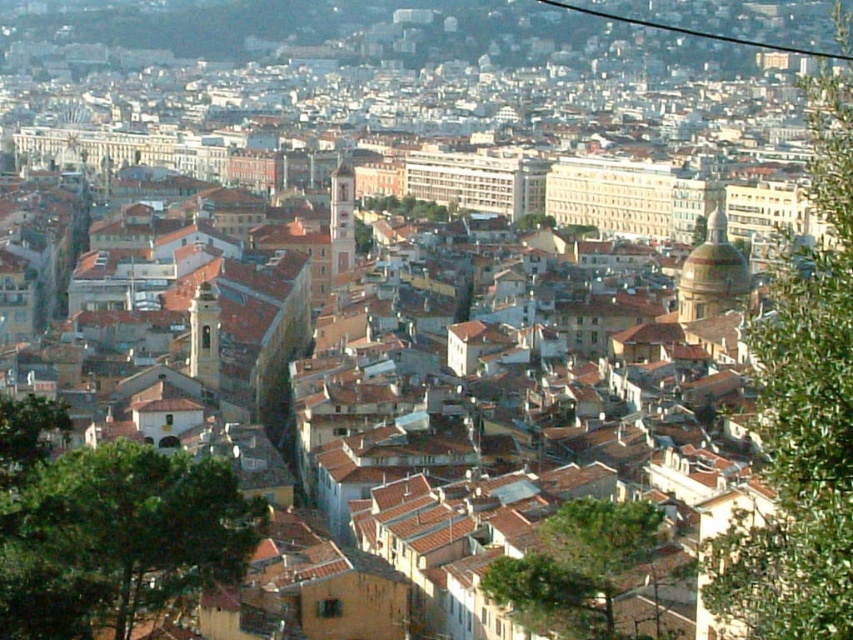
Is green leafy tree at right shorter than green leafy tree at lower left?

No, green leafy tree at right is not shorter than green leafy tree at lower left.

Does green leafy tree at right have a greater height compared to green leafy tree at lower left?

Yes.

Who is more distant from viewer, (788,602) or (13,566)?

The point (13,566) is more distant.

At what (x,y) coordinates should I click in order to perform the action: click on green leafy tree at right. Please return your answer as a coordinate pair (x, y). Looking at the image, I should click on (802, 419).

Is green leafy tree at right smaller than green leafy tree at center?

No, green leafy tree at right is not smaller than green leafy tree at center.

Between green leafy tree at right and green leafy tree at center, which one is positioned higher?

Positioned higher is green leafy tree at right.

Is point (845, 404) closer to viewer compared to point (514, 609)?

That is True.

The image size is (853, 640). I want to click on green leafy tree at right, so click(x=802, y=419).

Is point (108, 468) positioned behind point (608, 518)?

No, it is in front of (608, 518).

Looking at this image, which of these two, green leafy tree at lower left or green leafy tree at center, stands taller?

green leafy tree at lower left is taller.

Is point (175, 458) positioned before point (619, 636)?

Yes, point (175, 458) is in front of point (619, 636).

This screenshot has height=640, width=853. I want to click on green leafy tree at lower left, so click(115, 536).